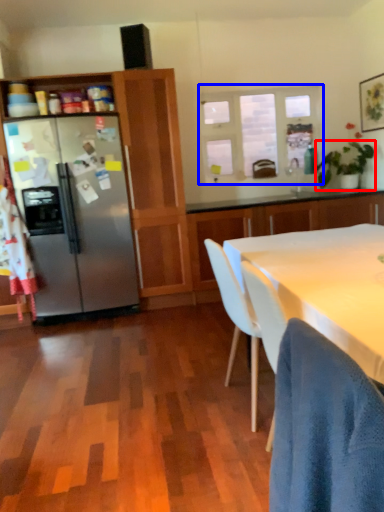
Question: Among these objects, which one is nearest to the camera, houseplant (highlighted by a red box) or window (highlighted by a blue box)?

Choices:
 (A) houseplant
 (B) window

Answer: (A)